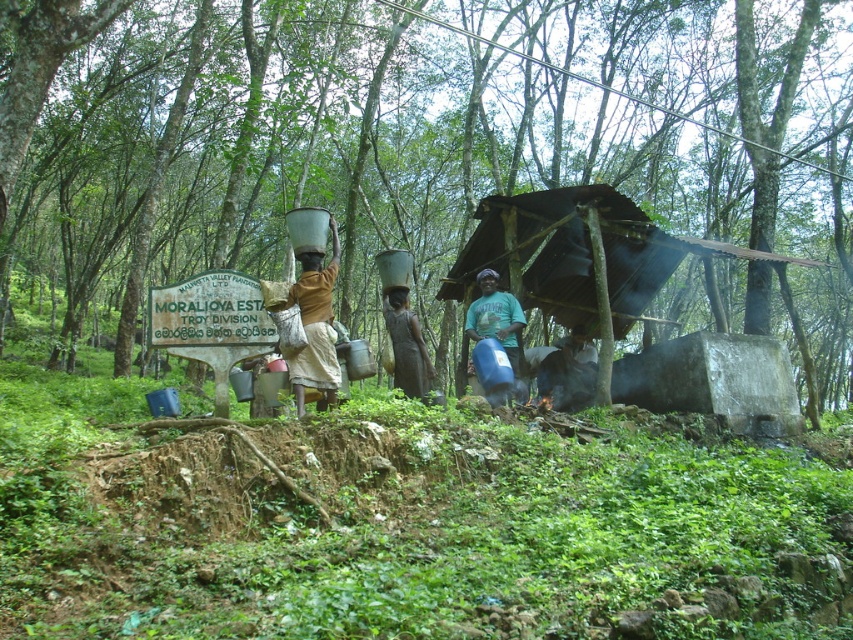
Question: Considering the relative positions of brown fabric at center and brown fabric dress at center in the image provided, where is brown fabric at center located with respect to brown fabric dress at center?

Choices:
 (A) right
 (B) left

Answer: (B)

Question: Is brown fabric at center to the right of charcoal gray stone pot at lower center from the viewer's perspective?

Choices:
 (A) no
 (B) yes

Answer: (A)

Question: Which object appears closest to the camera in this image?

Choices:
 (A) brown fabric at center
 (B) blue matte water container at center
 (C) green leafy forest at center

Answer: (A)

Question: Which of the following is the closest to the observer?

Choices:
 (A) blue matte water container at center
 (B) brown fabric dress at center
 (C) charcoal gray stone pot at lower center
 (D) green leafy forest at center

Answer: (D)

Question: Which is farther from the green leafy forest at center?

Choices:
 (A) brown fabric at center
 (B) brown fabric dress at center
 (C) charcoal gray stone pot at lower center
 (D) blue matte water container at center

Answer: (A)

Question: In this image, where is green leafy forest at center located relative to brown fabric at center?

Choices:
 (A) left
 (B) right

Answer: (A)